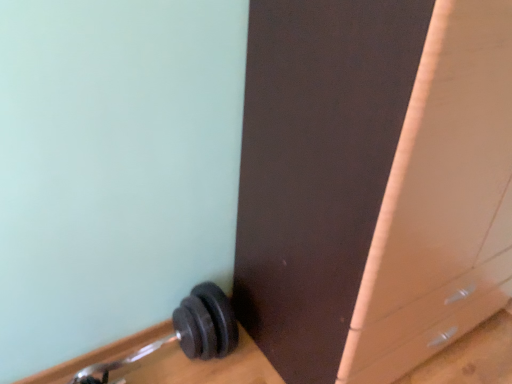
Question: Is black rubber dumbbell at lower left taller than matte brown file cabinet at lower right?

Choices:
 (A) no
 (B) yes

Answer: (A)

Question: Can we say black rubber dumbbell at lower left lies outside matte brown file cabinet at lower right?

Choices:
 (A) yes
 (B) no

Answer: (A)

Question: Is black rubber dumbbell at lower left in front of matte brown file cabinet at lower right?

Choices:
 (A) no
 (B) yes

Answer: (A)

Question: Does black rubber dumbbell at lower left have a larger size compared to matte brown file cabinet at lower right?

Choices:
 (A) yes
 (B) no

Answer: (B)

Question: Is black rubber dumbbell at lower left wider than matte brown file cabinet at lower right?

Choices:
 (A) yes
 (B) no

Answer: (B)

Question: Can you confirm if black rubber dumbbell at lower left is shorter than matte brown file cabinet at lower right?

Choices:
 (A) yes
 (B) no

Answer: (A)

Question: Is matte brown file cabinet at lower right completely or partially outside of black rubber dumbbell at lower left?

Choices:
 (A) yes
 (B) no

Answer: (A)

Question: Is matte brown file cabinet at lower right closer to camera compared to black rubber dumbbell at lower left?

Choices:
 (A) no
 (B) yes

Answer: (B)

Question: Can you confirm if matte brown file cabinet at lower right is positioned to the left of black rubber dumbbell at lower left?

Choices:
 (A) no
 (B) yes

Answer: (A)

Question: Does matte brown file cabinet at lower right have a larger size compared to black rubber dumbbell at lower left?

Choices:
 (A) yes
 (B) no

Answer: (A)

Question: Does matte brown file cabinet at lower right have a smaller size compared to black rubber dumbbell at lower left?

Choices:
 (A) no
 (B) yes

Answer: (A)

Question: Does matte brown file cabinet at lower right have a greater height compared to black rubber dumbbell at lower left?

Choices:
 (A) yes
 (B) no

Answer: (A)

Question: Considering the positions of black rubber dumbbell at lower left and matte brown file cabinet at lower right in the image, is black rubber dumbbell at lower left taller or shorter than matte brown file cabinet at lower right?

Choices:
 (A) tall
 (B) short

Answer: (B)